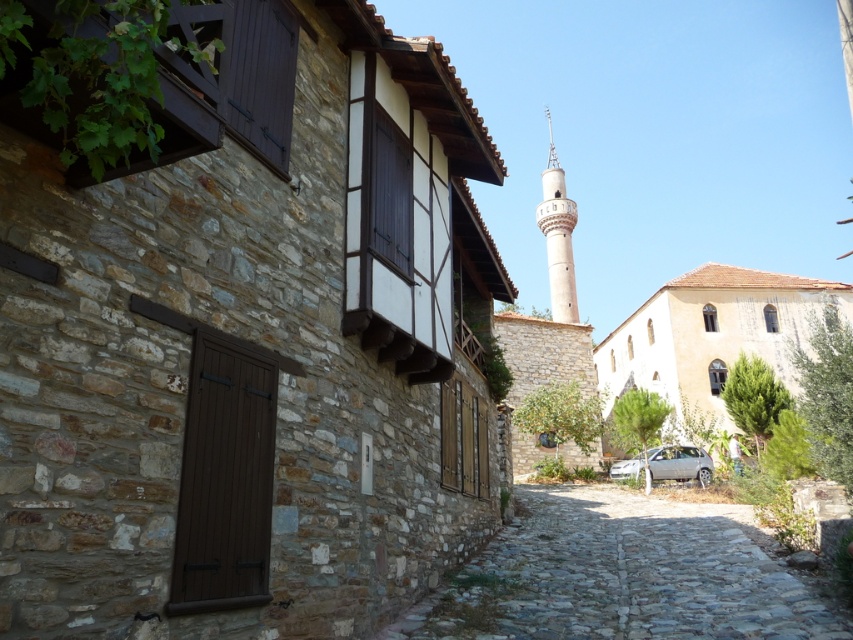
Question: Can you confirm if cobblestone path at center is smaller than silver metallic car at lower center?

Choices:
 (A) no
 (B) yes

Answer: (A)

Question: Is cobblestone path at center further to camera compared to smooth white minaret at center?

Choices:
 (A) no
 (B) yes

Answer: (A)

Question: Can you confirm if cobblestone path at center is positioned to the left of silver metallic car at lower center?

Choices:
 (A) yes
 (B) no

Answer: (A)

Question: Among these objects, which one is nearest to the camera?

Choices:
 (A) cobblestone path at center
 (B) silver metallic car at lower center

Answer: (A)

Question: Which of the following is the farthest from the observer?

Choices:
 (A) smooth white minaret at center
 (B) silver metallic car at lower center
 (C) cobblestone path at center

Answer: (A)

Question: Which object is the closest to the silver metallic car at lower center?

Choices:
 (A) cobblestone path at center
 (B) smooth white minaret at center

Answer: (A)